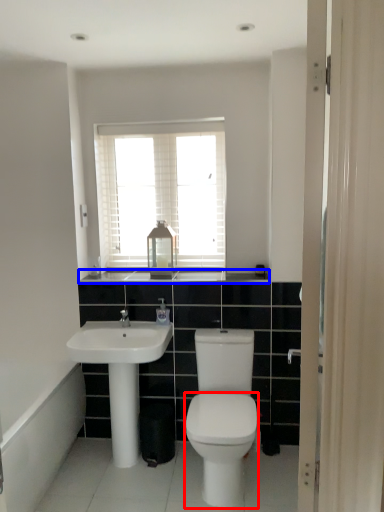
Question: Which object is further to the camera taking this photo, bidet (highlighted by a red box) or counter top (highlighted by a blue box)?

Choices:
 (A) bidet
 (B) counter top

Answer: (B)